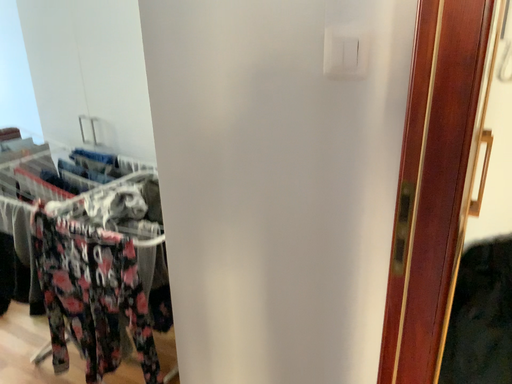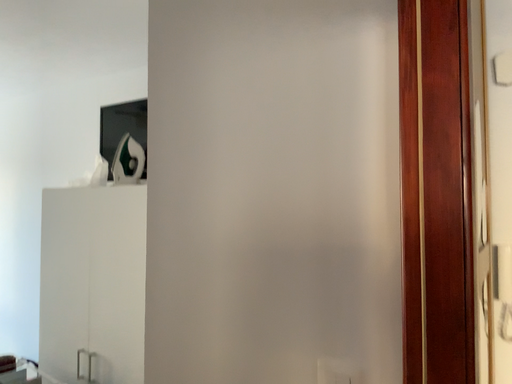
Question: How did the camera likely rotate when shooting the video?

Choices:
 (A) rotated upward
 (B) rotated downward

Answer: (A)